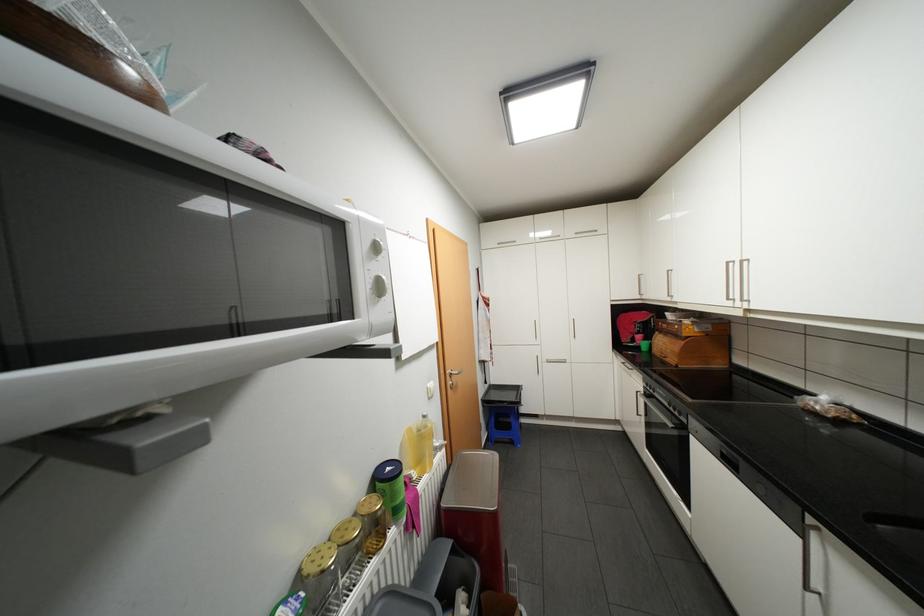
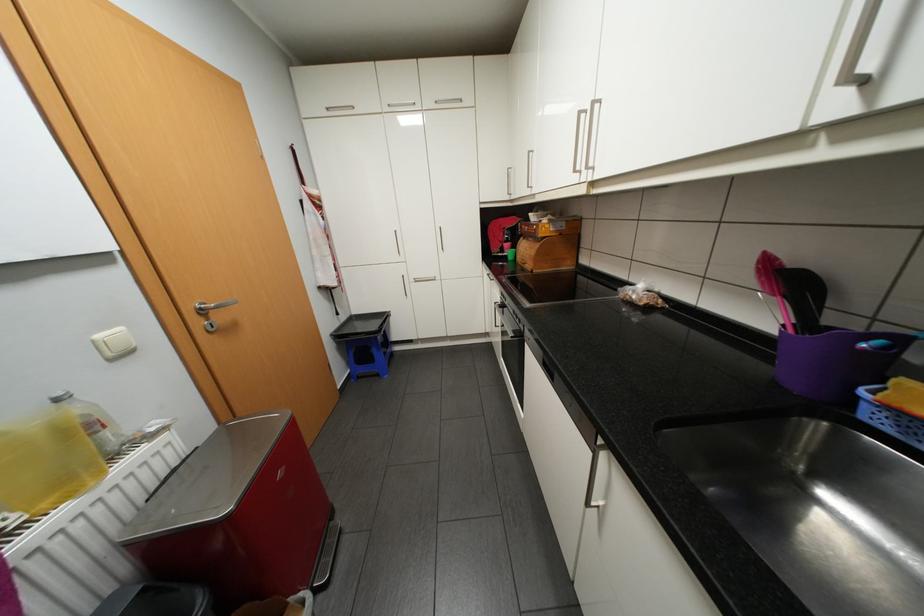
Where in the second image is the point corresponding to (x=432, y=416) from the first image?

(65, 399)